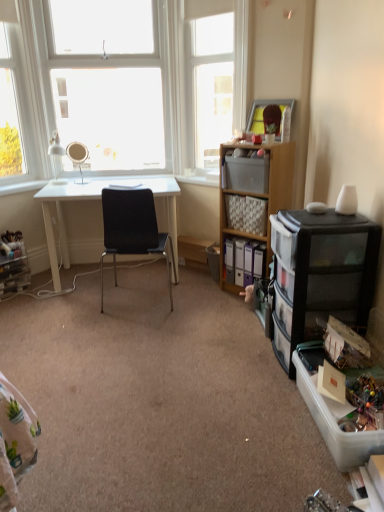
At what (x,y) coordinates should I click in order to perform the action: click on free location to the right of white glossy lamp at upper left. Please return your answer as a coordinate pair (x, y). The image size is (384, 512). Looking at the image, I should click on (82, 185).